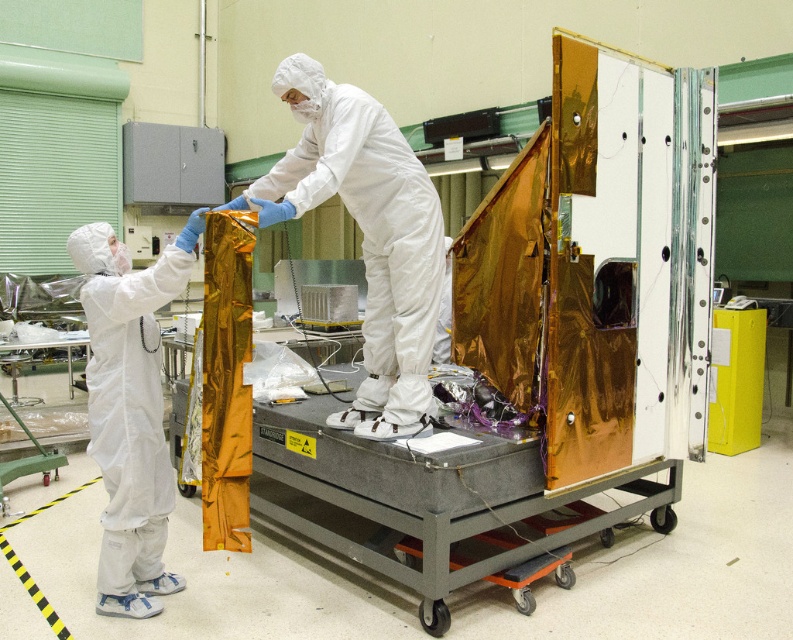
In the laboratory scene, there are two people wearing white matte suits. One is at the center and the other at the left. From the perspective of someone standing in front of the satellite, which direction is the white matte suit at center relative to the white matte suit at left?

The white matte suit at center is to the right of the white matte suit at left.